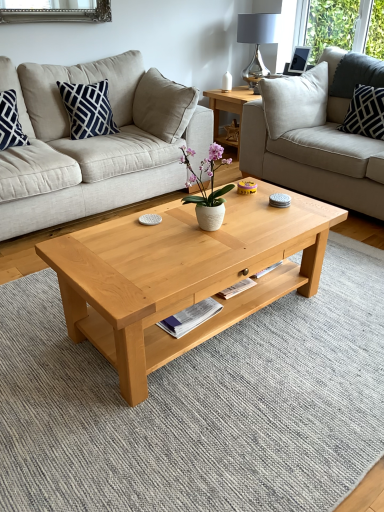
Question: Would you say matte black picture frame at upper right is inside or outside navy blue cotton pillow at upper left, placed as the 2th pillow when sorted from right to left?

Choices:
 (A) inside
 (B) outside

Answer: (B)

Question: Considering the positions of matte black picture frame at upper right and navy blue cotton pillow at upper left, which is the first pillow in left-to-right order, in the image, is matte black picture frame at upper right taller or shorter than navy blue cotton pillow at upper left, which is the first pillow in left-to-right order,?

Choices:
 (A) tall
 (B) short

Answer: (B)

Question: Which object is the farthest from the navy blue cotton pillow at upper left, placed as the 2th pillow when sorted from right to left?

Choices:
 (A) light gray fabric couch at upper right, the 1th studio couch from the right
 (B) beige fabric couch at center, arranged as the 2th studio couch when viewed from the right
 (C) matte black picture frame at upper right
 (D) natural wood coffee table at center
 (E) metallic silver lamp at upper right

Answer: (E)

Question: Estimate the real-world distances between objects in this image. Which object is closer to the light gray fabric couch at upper right, the 1th studio couch from the right?

Choices:
 (A) metallic silver lamp at upper right
 (B) navy blue cotton pillow at upper left, placed as the 2th pillow when sorted from right to left
 (C) matte black picture frame at upper right
 (D) natural wood coffee table at center
 (E) white cotton pillow at upper right, the 2th pillow when ordered from left to right

Answer: (E)